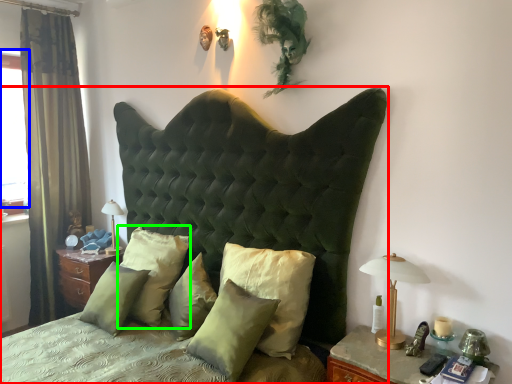
Question: Based on their relative distances, which object is nearer to bed (highlighted by a red box)? Choose from window screen (highlighted by a blue box) and pillow (highlighted by a green box).

Choices:
 (A) window screen
 (B) pillow

Answer: (B)